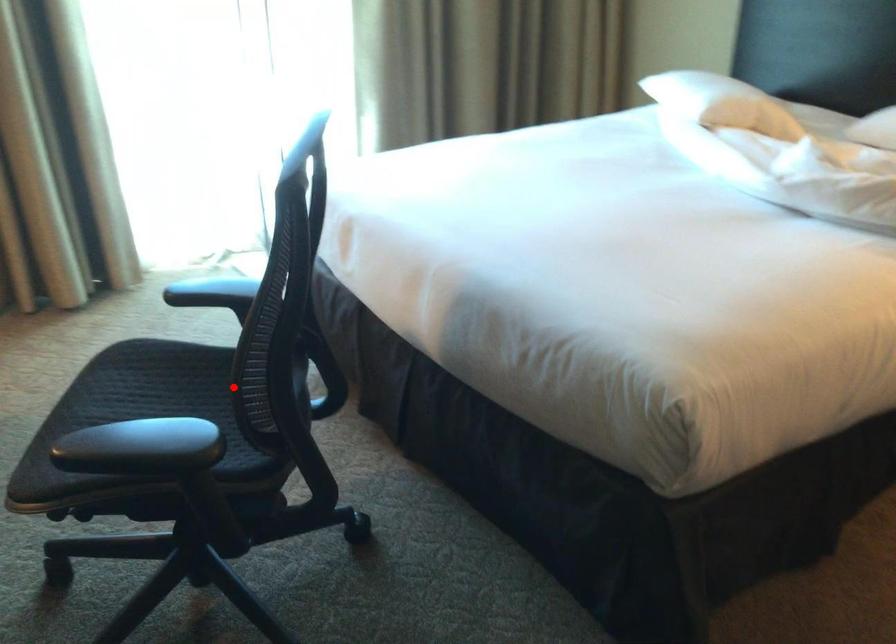
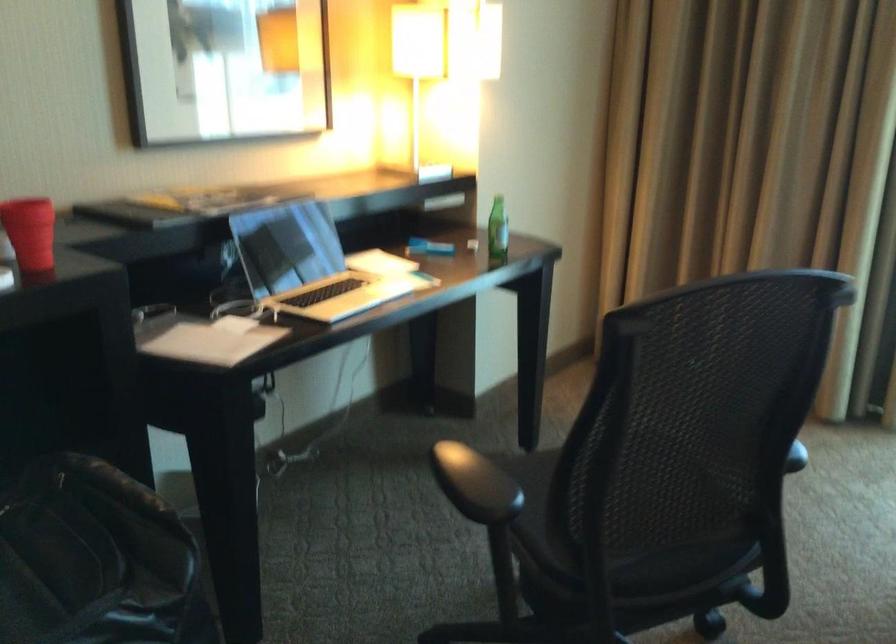
Where in the second image is the point corresponding to the highlighted location from the first image?

(558, 480)